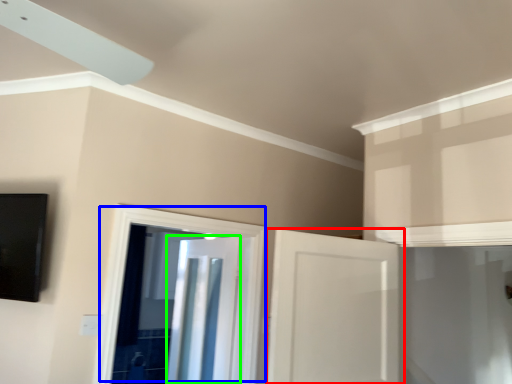
Question: Which is nearer to the door (highlighted by a red box)? door (highlighted by a blue box) or door (highlighted by a green box).

Choices:
 (A) door
 (B) door

Answer: (A)